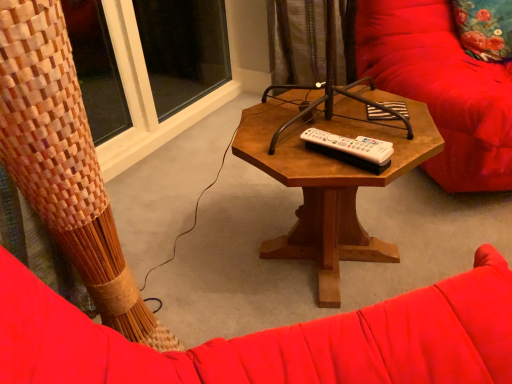
Question: Could you tell me if floral fabric pillow at upper right is turned towards velvet red swivel chair at right?

Choices:
 (A) yes
 (B) no

Answer: (A)

Question: Is floral fabric pillow at upper right shorter than velvet red swivel chair at right?

Choices:
 (A) no
 (B) yes

Answer: (B)

Question: Is velvet red swivel chair at right at the back of floral fabric pillow at upper right?

Choices:
 (A) yes
 (B) no

Answer: (A)

Question: From the image's perspective, would you say floral fabric pillow at upper right is shown under velvet red swivel chair at right?

Choices:
 (A) yes
 (B) no

Answer: (B)

Question: Can you confirm if floral fabric pillow at upper right is smaller than velvet red swivel chair at right?

Choices:
 (A) no
 (B) yes

Answer: (B)

Question: From a real-world perspective, is white plastic remote at center physically located above or below woodenobject at center?

Choices:
 (A) below
 (B) above

Answer: (B)

Question: In terms of width, does white plastic remote at center look wider or thinner when compared to woodenobject at center?

Choices:
 (A) thin
 (B) wide

Answer: (A)

Question: Is white plastic remote at center inside or outside of woodenobject at center?

Choices:
 (A) inside
 (B) outside

Answer: (A)

Question: Looking at the image, does white plastic remote at center seem bigger or smaller compared to woodenobject at center?

Choices:
 (A) big
 (B) small

Answer: (B)

Question: Relative to transparent glass window at upper left, is woodenobject at center in front or behind?

Choices:
 (A) behind
 (B) front

Answer: (B)

Question: From a real-world perspective, relative to transparent glass window at upper left, is woodenobject at center vertically above or below?

Choices:
 (A) above
 (B) below

Answer: (B)

Question: Is woodenobject at center wider or thinner than transparent glass window at upper left?

Choices:
 (A) thin
 (B) wide

Answer: (B)

Question: Would you say woodenobject at center is to the left or to the right of transparent glass window at upper left in the picture?

Choices:
 (A) right
 (B) left

Answer: (A)

Question: Is velvet red swivel chair at right taller or shorter than white plastic remote at center?

Choices:
 (A) short
 (B) tall

Answer: (B)

Question: Is point (485, 107) closer or farther from the camera than point (375, 148)?

Choices:
 (A) farther
 (B) closer

Answer: (A)